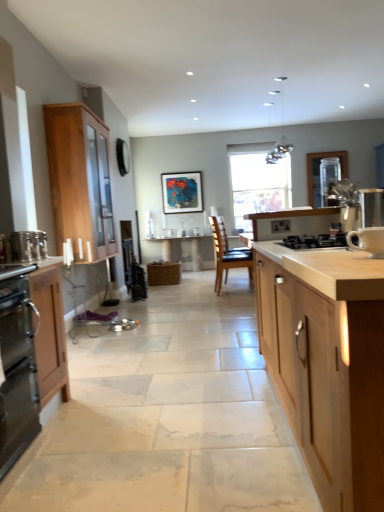
Question: Is metallic glass pendant lights at upper center thinner than white ceramic mug at right, positioned as the 2th appliance in left-to-right order?

Choices:
 (A) no
 (B) yes

Answer: (A)

Question: Considering the relative sizes of metallic glass pendant lights at upper center and white ceramic mug at right, which is the 2th appliance from right to left, in the image provided, is metallic glass pendant lights at upper center bigger than white ceramic mug at right, which is the 2th appliance from right to left,?

Choices:
 (A) yes
 (B) no

Answer: (A)

Question: Is metallic glass pendant lights at upper center wider than white ceramic mug at right, positioned as the 3th appliance in back-to-front order?

Choices:
 (A) yes
 (B) no

Answer: (A)

Question: From a real-world perspective, is metallic glass pendant lights at upper center below white ceramic mug at right, positioned as the 2th appliance in left-to-right order?

Choices:
 (A) no
 (B) yes

Answer: (A)

Question: Considering the relative sizes of metallic glass pendant lights at upper center and white ceramic mug at right, which is the 2th appliance from right to left, in the image provided, is metallic glass pendant lights at upper center shorter than white ceramic mug at right, which is the 2th appliance from right to left,?

Choices:
 (A) yes
 (B) no

Answer: (B)

Question: Does metallic glass pendant lights at upper center lie behind white ceramic mug at right, positioned as the 2th appliance in left-to-right order?

Choices:
 (A) no
 (B) yes

Answer: (B)

Question: Considering the relative positions of brown leather chair at center and black matte gas stove at center in the image provided, is brown leather chair at center to the left of black matte gas stove at center from the viewer's perspective?

Choices:
 (A) yes
 (B) no

Answer: (A)

Question: Could you tell me if brown leather chair at center is facing black matte gas stove at center?

Choices:
 (A) yes
 (B) no

Answer: (B)

Question: Considering the relative sizes of brown leather chair at center and black matte gas stove at center in the image provided, is brown leather chair at center shorter than black matte gas stove at center?

Choices:
 (A) yes
 (B) no

Answer: (B)

Question: Is the surface of brown leather chair at center in direct contact with black matte gas stove at center?

Choices:
 (A) no
 (B) yes

Answer: (A)

Question: Considering the relative positions of brown leather chair at center and black matte gas stove at center in the image provided, is brown leather chair at center behind black matte gas stove at center?

Choices:
 (A) no
 (B) yes

Answer: (B)

Question: Is brown leather chair at center not within black matte gas stove at center?

Choices:
 (A) no
 (B) yes

Answer: (B)

Question: Considering the relative positions of brown leather chair at center and metallic glass pendant lights at upper center in the image provided, is brown leather chair at center in front of metallic glass pendant lights at upper center?

Choices:
 (A) no
 (B) yes

Answer: (A)